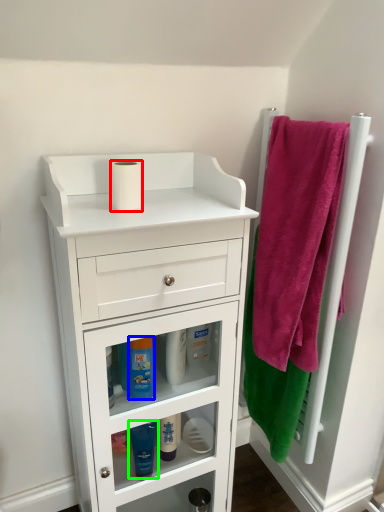
Question: Based on their relative distances, which object is nearer to toilet paper (highlighted by a red box)? Choose from mouthwash (highlighted by a blue box) and mouthwash (highlighted by a green box).

Choices:
 (A) mouthwash
 (B) mouthwash

Answer: (A)